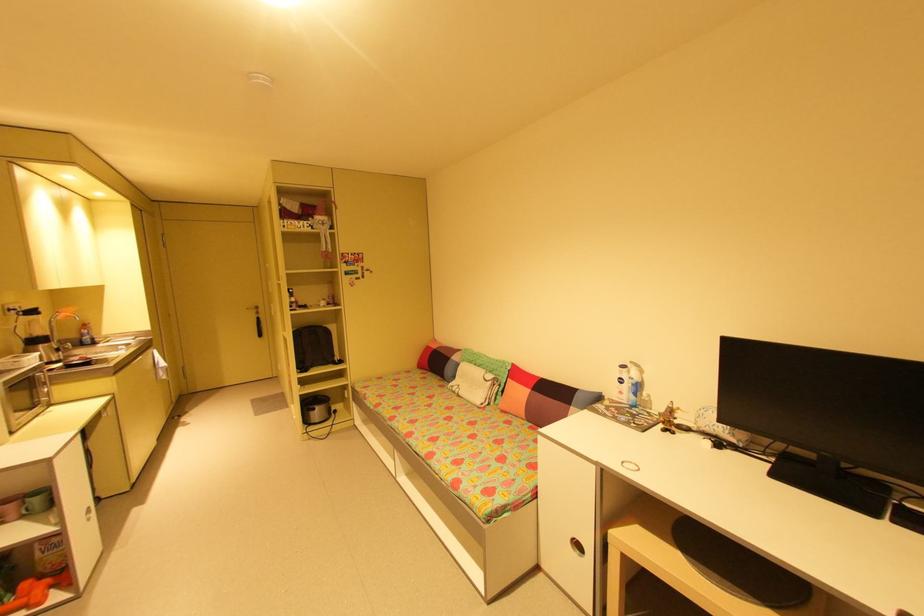
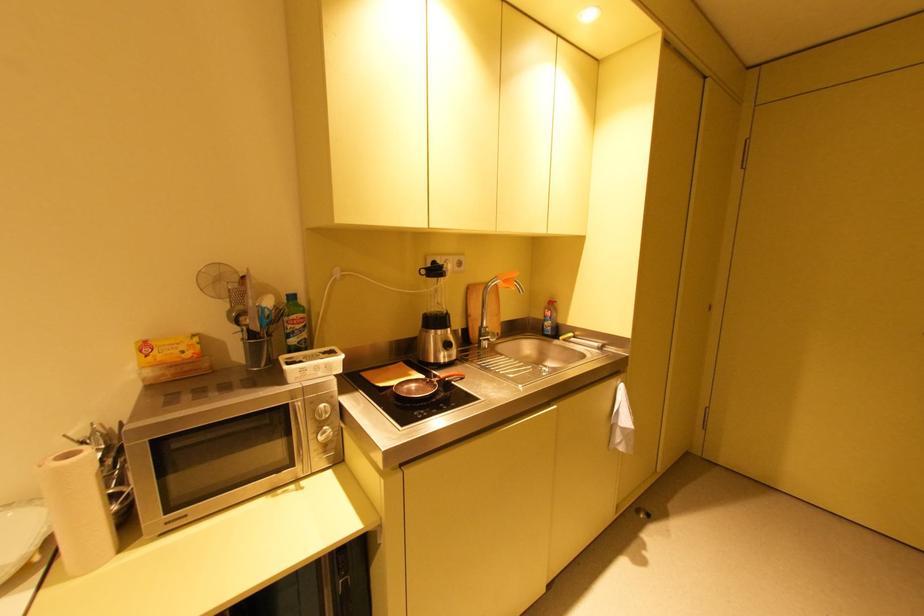
In the second image, find the point that corresponds to pixel 90 338 in the first image.

(551, 323)